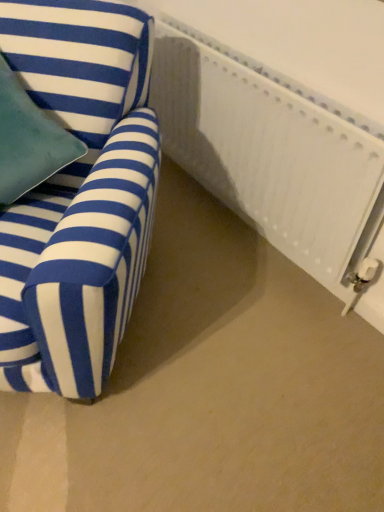
Question: Is blue striped fabric chair at left positioned with its back to white textured radiator at right?

Choices:
 (A) no
 (B) yes

Answer: (A)

Question: From the image's perspective, is blue striped fabric chair at left below white textured radiator at right?

Choices:
 (A) yes
 (B) no

Answer: (A)

Question: Considering the relative sizes of blue striped fabric chair at left and white textured radiator at right in the image provided, is blue striped fabric chair at left taller than white textured radiator at right?

Choices:
 (A) no
 (B) yes

Answer: (B)

Question: From a real-world perspective, is blue striped fabric chair at left under white textured radiator at right?

Choices:
 (A) no
 (B) yes

Answer: (A)

Question: Does blue striped fabric chair at left have a smaller size compared to white textured radiator at right?

Choices:
 (A) yes
 (B) no

Answer: (B)

Question: Is blue striped fabric chair at left aimed at white textured radiator at right?

Choices:
 (A) yes
 (B) no

Answer: (B)

Question: Does white textured radiator at right turn towards blue striped fabric chair at left?

Choices:
 (A) yes
 (B) no

Answer: (A)

Question: From the image's perspective, is white textured radiator at right under blue striped fabric chair at left?

Choices:
 (A) yes
 (B) no

Answer: (B)

Question: Considering the relative sizes of white textured radiator at right and blue striped fabric chair at left in the image provided, is white textured radiator at right wider than blue striped fabric chair at left?

Choices:
 (A) no
 (B) yes

Answer: (A)

Question: Can you confirm if white textured radiator at right is smaller than blue striped fabric chair at left?

Choices:
 (A) yes
 (B) no

Answer: (A)

Question: Are white textured radiator at right and blue striped fabric chair at left making contact?

Choices:
 (A) yes
 (B) no

Answer: (B)

Question: Is blue striped fabric chair at left completely or partially inside white textured radiator at right?

Choices:
 (A) yes
 (B) no

Answer: (B)

Question: From their relative heights in the image, would you say blue striped fabric chair at left is taller or shorter than white textured radiator at right?

Choices:
 (A) tall
 (B) short

Answer: (A)